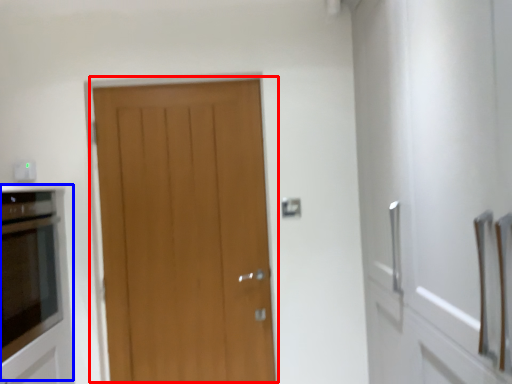
Question: Which point is closer to the camera, door (highlighted by a red box) or appliance (highlighted by a blue box)?

Choices:
 (A) door
 (B) appliance

Answer: (B)